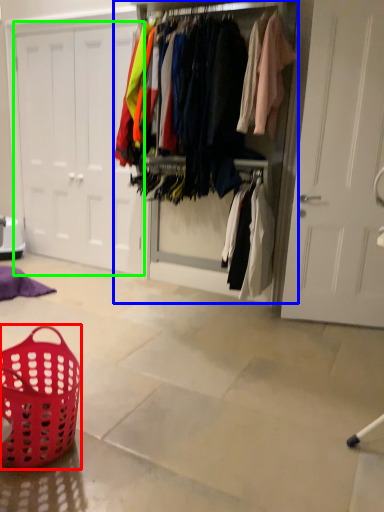
Question: Which is nearer to the basket (highlighted by a red box)? closet (highlighted by a blue box) or door (highlighted by a green box).

Choices:
 (A) closet
 (B) door

Answer: (A)